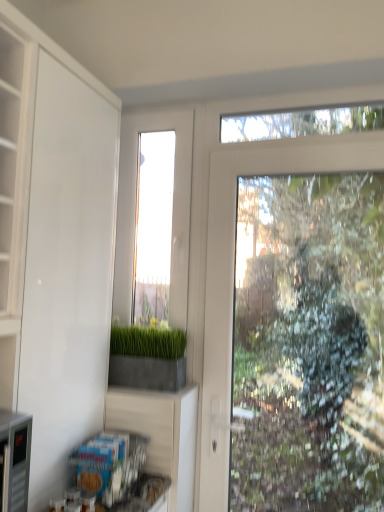
Question: From a real-world perspective, is concrete planter at center positioned over white matte cabinet at left based on gravity?

Choices:
 (A) no
 (B) yes

Answer: (A)

Question: Considering the relative sizes of concrete planter at center and white matte cabinet at left in the image provided, is concrete planter at center shorter than white matte cabinet at left?

Choices:
 (A) no
 (B) yes

Answer: (B)

Question: From the image's perspective, is concrete planter at center above white matte cabinet at left?

Choices:
 (A) no
 (B) yes

Answer: (A)

Question: Are concrete planter at center and white matte cabinet at left far apart?

Choices:
 (A) no
 (B) yes

Answer: (A)

Question: Is concrete planter at center located outside white matte cabinet at left?

Choices:
 (A) yes
 (B) no

Answer: (A)

Question: Considering the positions of point (125, 266) and point (84, 196), is point (125, 266) closer or farther from the camera than point (84, 196)?

Choices:
 (A) farther
 (B) closer

Answer: (A)

Question: In terms of size, does clear glass window at center appear bigger or smaller than white matte cabinet at left?

Choices:
 (A) small
 (B) big

Answer: (A)

Question: Considering the positions of clear glass window at center and white matte cabinet at left in the image, is clear glass window at center taller or shorter than white matte cabinet at left?

Choices:
 (A) short
 (B) tall

Answer: (A)

Question: In terms of width, does clear glass window at center look wider or thinner when compared to white matte cabinet at left?

Choices:
 (A) wide
 (B) thin

Answer: (B)

Question: Considering the positions of white matte cabinet at left and clear glass window at center in the image, is white matte cabinet at left bigger or smaller than clear glass window at center?

Choices:
 (A) big
 (B) small

Answer: (A)

Question: Based on their positions, is white matte cabinet at left located to the left or right of clear glass window at center?

Choices:
 (A) right
 (B) left

Answer: (B)

Question: From a real-world perspective, is white matte cabinet at left physically located above or below clear glass window at center?

Choices:
 (A) above
 (B) below

Answer: (B)

Question: From the image's perspective, is white matte cabinet at left located above or below clear glass window at center?

Choices:
 (A) below
 (B) above

Answer: (A)

Question: Does point (112, 150) appear closer or farther from the camera than point (134, 352)?

Choices:
 (A) farther
 (B) closer

Answer: (B)

Question: From the image's perspective, is white matte cabinet at left located above or below concrete planter at center?

Choices:
 (A) above
 (B) below

Answer: (A)